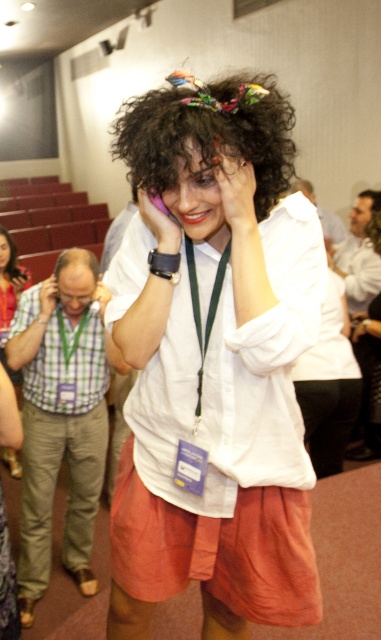
Question: Does white cotton shirt at center appear on the right side of white matte hand at center?

Choices:
 (A) no
 (B) yes

Answer: (A)

Question: Which point is farther to the camera?

Choices:
 (A) matte black phone at upper left
 (B) dark curly hair at upper center
 (C) matte white hair at center
 (D) smooth skin head at upper right

Answer: (B)

Question: Which point appears closest to the camera in this image?

Choices:
 (A) (300, 179)
 (B) (140, 212)
 (C) (86, 259)
 (D) (44, 312)

Answer: (B)

Question: Which of the following is the farthest from the observer?

Choices:
 (A) (281, 168)
 (B) (377, 192)

Answer: (B)

Question: Is purple matte phone at upper center behind matte black phone at upper left?

Choices:
 (A) yes
 (B) no

Answer: (B)

Question: Does smooth skin head at upper right appear on the right side of dark curly hair at upper center?

Choices:
 (A) yes
 (B) no

Answer: (A)